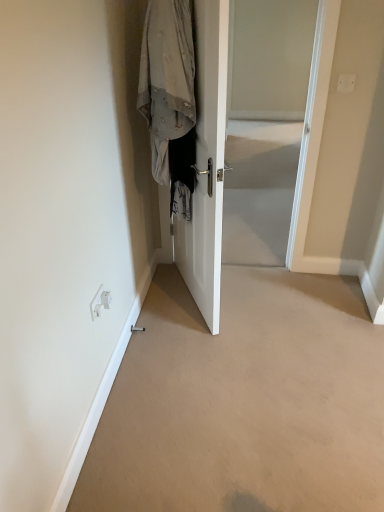
Where is `vacant region in front of white glossy door at center`? The height and width of the screenshot is (512, 384). vacant region in front of white glossy door at center is located at coordinates (206, 344).